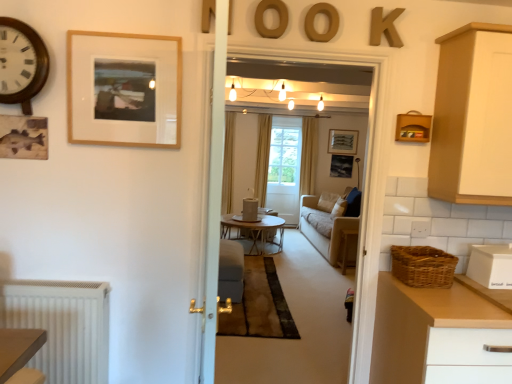
Question: Is wooden letter k at upper right, the fourth letter in the left-to-right sequence, positioned with its back to wooden clock at upper left?

Choices:
 (A) yes
 (B) no

Answer: (B)

Question: From the image's perspective, does wooden letter k at upper right, the fourth letter in the left-to-right sequence, appear higher than wooden clock at upper left?

Choices:
 (A) yes
 (B) no

Answer: (A)

Question: Does wooden letter k at upper right, the first letter in the right-to-left sequence, have a lesser width compared to wooden clock at upper left?

Choices:
 (A) yes
 (B) no

Answer: (A)

Question: Is wooden clock at upper left surrounded by wooden letter k at upper right, the first letter in the right-to-left sequence?

Choices:
 (A) yes
 (B) no

Answer: (B)

Question: Can you confirm if wooden letter k at upper right, the fourth letter in the left-to-right sequence, is smaller than wooden clock at upper left?

Choices:
 (A) yes
 (B) no

Answer: (A)

Question: Is wooden letter k at upper right, the fourth letter in the left-to-right sequence, not close to wooden clock at upper left?

Choices:
 (A) no
 (B) yes

Answer: (B)

Question: From a real-world perspective, is wooden letter at upper center, which is the 2th letter in left-to-right order, positioned over wooden round coffee table at center based on gravity?

Choices:
 (A) no
 (B) yes

Answer: (B)

Question: Considering the relative sizes of wooden letter at upper center, which is the 2th letter in left-to-right order, and wooden round coffee table at center in the image provided, is wooden letter at upper center, which is the 2th letter in left-to-right order, smaller than wooden round coffee table at center?

Choices:
 (A) no
 (B) yes

Answer: (B)

Question: Can you confirm if wooden letter at upper center, which is the 2th letter in left-to-right order, is bigger than wooden round coffee table at center?

Choices:
 (A) yes
 (B) no

Answer: (B)

Question: From the image's perspective, is wooden letter at upper center, which is the third letter in right-to-left order, under wooden round coffee table at center?

Choices:
 (A) no
 (B) yes

Answer: (A)

Question: Is wooden letter at upper center, which is the 2th letter in left-to-right order, facing away from wooden round coffee table at center?

Choices:
 (A) no
 (B) yes

Answer: (A)

Question: Can you confirm if wooden letter at upper center, which is the 2th letter in left-to-right order, is thinner than wooden round coffee table at center?

Choices:
 (A) yes
 (B) no

Answer: (A)

Question: Is matte black picture frame at center, the third picture frame in the front-to-back sequence, at the back of wooden round table at center?

Choices:
 (A) yes
 (B) no

Answer: (A)